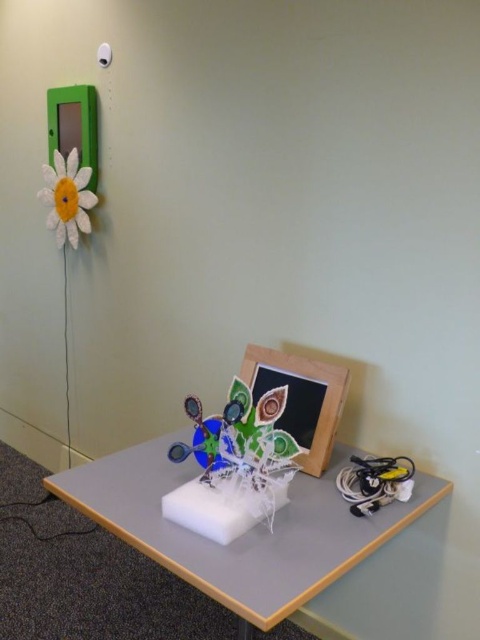
Looking at this image, you are setting up a display and need to know which object is shorter between the white foam block at center and the wooden picture frame at center. Can you tell me which one is shorter?

The white foam block at center is not as tall as the wooden picture frame at center, so the white foam block at center is shorter.

You are standing in front of the workspace and want to place a new decorative item on the wooden picture frame at center. Considering your reach, which is about 3 feet, can you comfortably place the item without moving closer?

The wooden picture frame at center is 5.08 feet away from the viewer. Since your reach is about 3 feet, you cannot comfortably place the item without moving closer.